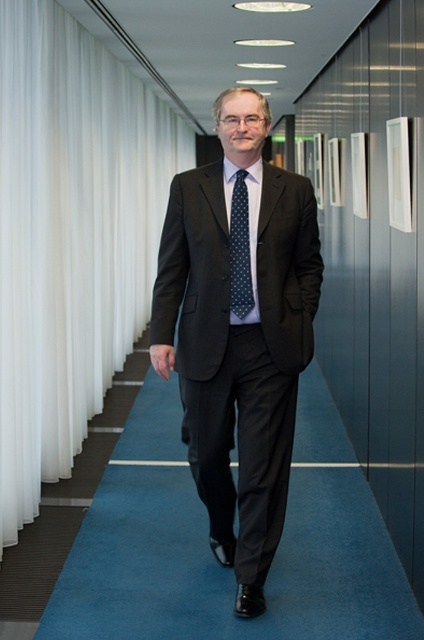
Which is behind, point (42, 212) or point (229, 269)?

The point (42, 212) is more distant.

Between white sheer curtain at left and dark green dotted tie at center, which one appears on the right side from the viewer's perspective?

dark green dotted tie at center

Image resolution: width=424 pixels, height=640 pixels. I want to click on white sheer curtain at left, so tap(70, 237).

You are a GUI agent. You are given a task and a screenshot of the screen. Output one action in this format:
    pyautogui.click(x=<x>, y=<y>)
    Task: Click on the white sheer curtain at left
    This screenshot has height=640, width=424.
    Given the screenshot: What is the action you would take?
    pyautogui.click(x=70, y=237)

Is white sheer curtain at left to the left of matte black suit at center from the viewer's perspective?

Yes, white sheer curtain at left is to the left of matte black suit at center.

Does point (27, 355) come in front of point (254, 349)?

No, (27, 355) is further to viewer.

Who is more distant from viewer, (27, 81) or (226, 342)?

The point (27, 81) is behind.

The height and width of the screenshot is (640, 424). Find the location of `white sheer curtain at left`. white sheer curtain at left is located at coordinates (70, 237).

Between matte black suit at center and dark green dotted tie at center, which one appears on the left side from the viewer's perspective?

From the viewer's perspective, matte black suit at center appears more on the left side.

Who is positioned more to the right, matte black suit at center or dark green dotted tie at center?

dark green dotted tie at center

Does point (212, 419) come farther from viewer compared to point (237, 284)?

Yes, it is behind point (237, 284).

Where is `matte black suit at center`? The height and width of the screenshot is (640, 424). matte black suit at center is located at coordinates (239, 333).